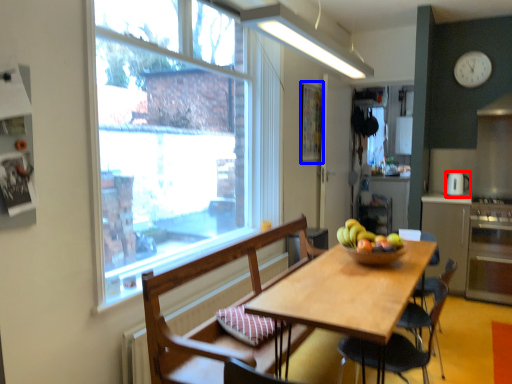
Question: Which of the following is the closest to the observer, coffee machine (highlighted by a red box) or bulletin board (highlighted by a blue box)?

Choices:
 (A) coffee machine
 (B) bulletin board

Answer: (B)